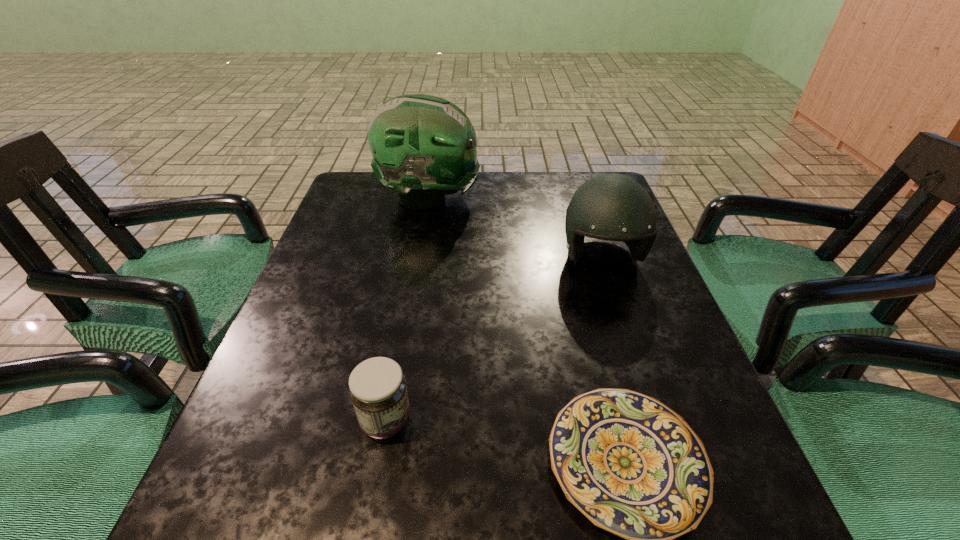
This screenshot has height=540, width=960. I want to click on the second closest object relative to the jam, so click(x=614, y=207).

At what (x,y) coordinates should I click in order to perform the action: click on free space that satisfies the following two spatial constraints: 1. at the face opening of the second tallest object; 2. on the front label of the third tallest object. Please return your answer as a coordinate pair (x, y). The width and height of the screenshot is (960, 540). Looking at the image, I should click on (656, 421).

I want to click on free space that satisfies the following two spatial constraints: 1. at the face opening of the second farthest object; 2. on the front label of the jam, so click(656, 421).